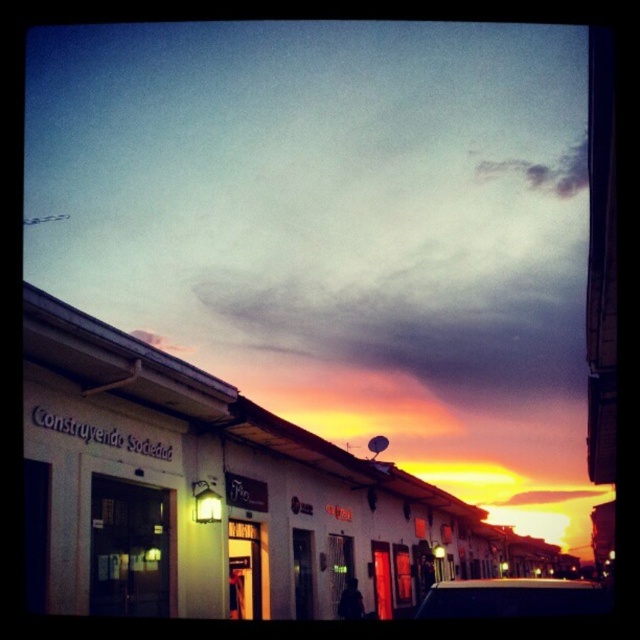
From the picture: Is cloudy sky at upper center to the left of white glossy car at lower center from the viewer's perspective?

Incorrect, cloudy sky at upper center is not on the left side of white glossy car at lower center.

Is point (209, 240) behind point (563, 580)?

That is True.

Which is behind, point (326, 214) or point (556, 592)?

Positioned behind is point (326, 214).

This screenshot has width=640, height=640. Identify the location of cloudy sky at upper center. (400, 276).